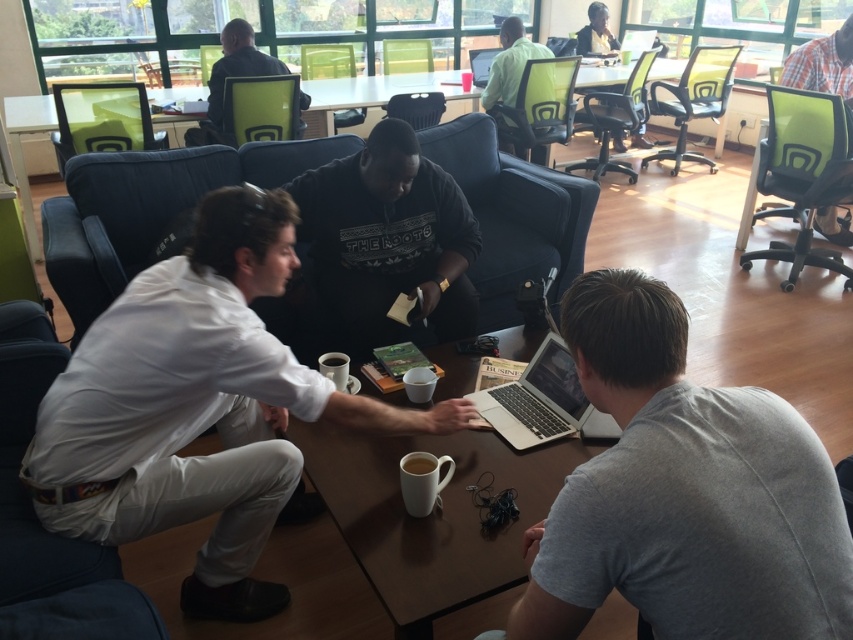
Can you confirm if green matte chair at upper center is taller than white matte mug at center?

Indeed, green matte chair at upper center has a greater height compared to white matte mug at center.

Can you confirm if green matte chair at upper center is positioned above white matte mug at center?

Indeed, green matte chair at upper center is positioned over white matte mug at center.

Between point (502, 81) and point (404, 461), which one is positioned in front?

Point (404, 461) is in front.

This screenshot has width=853, height=640. I want to click on green matte chair at upper center, so click(x=509, y=64).

In the scene shown: Can you confirm if wooden table at center is thinner than green matte chair at upper center?

No.

Between point (372, 522) and point (515, 44), which one is positioned in front?

Point (372, 522) is more forward.

Image resolution: width=853 pixels, height=640 pixels. What do you see at coordinates (432, 515) in the screenshot? I see `wooden table at center` at bounding box center [432, 515].

Where is `wooden table at center`? wooden table at center is located at coordinates (432, 515).

Does black sweater at center have a greater height compared to green matte chair at upper center?

Yes.

Which is more to the right, black sweater at center or green matte chair at upper center?

green matte chair at upper center is more to the right.

Locate an element on the screen. The width and height of the screenshot is (853, 640). black sweater at center is located at coordinates (387, 241).